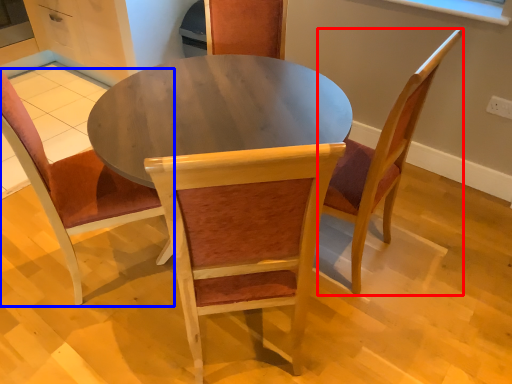
Question: Which of the following is the closest to the observer, chair (highlighted by a red box) or chair (highlighted by a blue box)?

Choices:
 (A) chair
 (B) chair

Answer: (B)